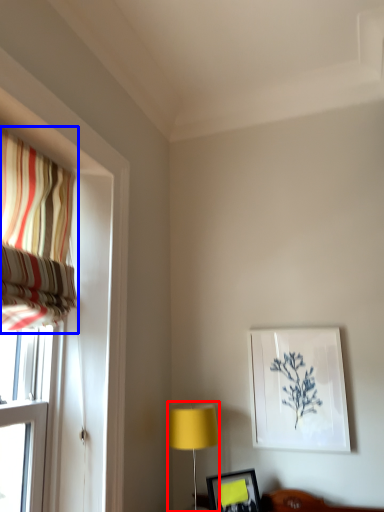
Question: Which point is closer to the camera, table lamp (highlighted by a red box) or curtain (highlighted by a blue box)?

Choices:
 (A) table lamp
 (B) curtain

Answer: (B)